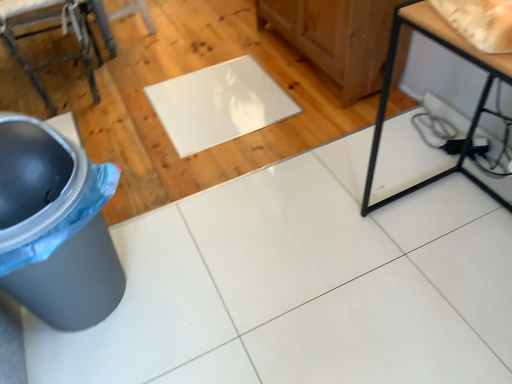
Identify the location of vacant space underneath metallic gray stool at upper left (from a real-world perspective). This screenshot has width=512, height=384. (83, 89).